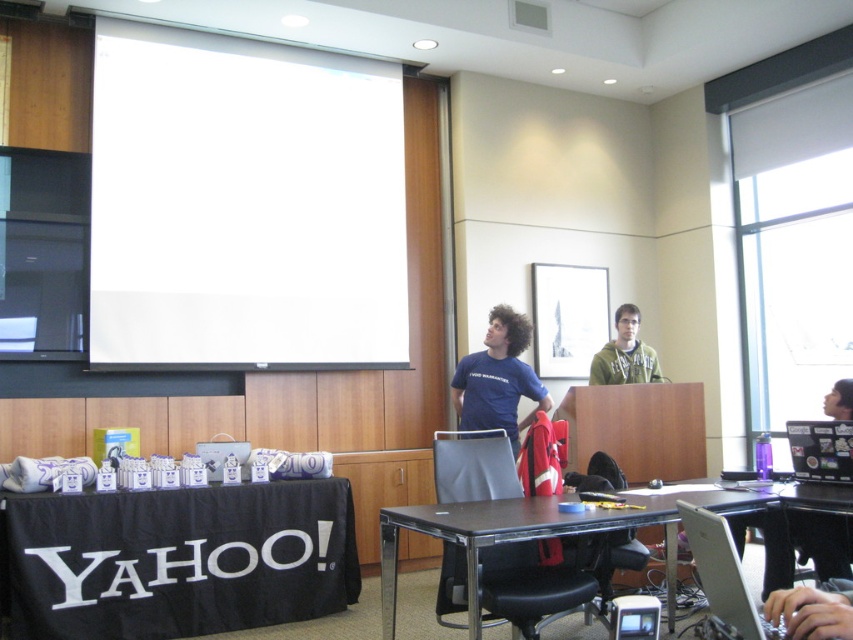
Question: Which point appears closest to the camera in this image?

Choices:
 (A) (577, 528)
 (B) (631, 344)

Answer: (A)

Question: Does silver metallic laptop at lower right have a greater width compared to black plastic laptop at lower right?

Choices:
 (A) yes
 (B) no

Answer: (B)

Question: Which point appears closest to the camera in this image?

Choices:
 (A) (843, 435)
 (B) (251, 504)
 (C) (788, 547)
 (D) (482, 358)

Answer: (A)

Question: Which is farther from the black plastic laptop at lower right?

Choices:
 (A) green hoodie at center
 (B) black glossy laptop at lower right
 (C) black metal table at lower center
 (D) black fabric table at lower left

Answer: (D)

Question: Is black fabric table at lower left above green hoodie at center?

Choices:
 (A) yes
 (B) no

Answer: (B)

Question: Where is black metal table at lower center located in relation to black plastic laptop at lower right in the image?

Choices:
 (A) right
 (B) left

Answer: (B)